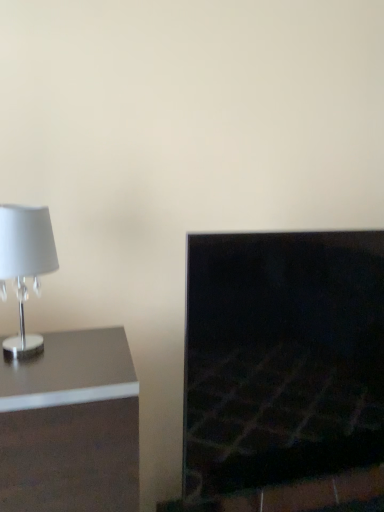
Locate an element on the screen. This screenshot has height=512, width=384. free space to the back side of white glossy lampshade at left is located at coordinates (76, 336).